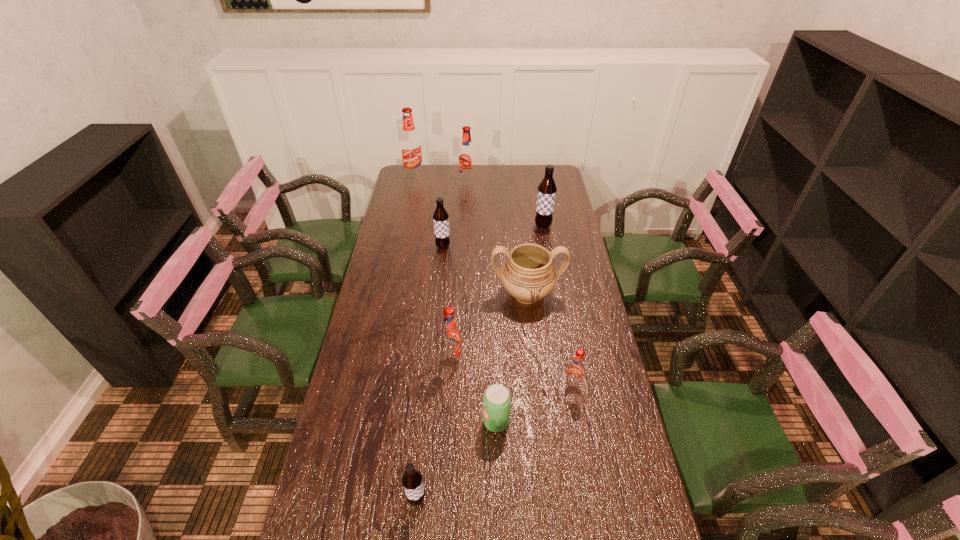
Locate an element on the screen. the second nearest root beer is located at coordinates (576, 370).

Locate an element on the screen. The image size is (960, 540). the nearest red root beer is located at coordinates (576, 370).

The image size is (960, 540). I want to click on the nearest object, so point(412,481).

Where is `the nearest brown root beer`? This screenshot has height=540, width=960. the nearest brown root beer is located at coordinates (412, 481).

This screenshot has height=540, width=960. Find the location of `the second nearest object`. the second nearest object is located at coordinates (496, 401).

Locate an element on the screen. the shortest object is located at coordinates (496, 401).

I want to click on free location located on the right of the leftmost root beer, so coord(494,176).

Identify the location of vacant space located 0.260m on the front of the third smallest red root beer. Image resolution: width=960 pixels, height=540 pixels. (467, 217).

The height and width of the screenshot is (540, 960). In order to click on vacant space positioned 0.400m on the left of the third farthest object in this screenshot , I will do `click(445, 226)`.

Find the location of `vacant space positioned on the front of the second nearest brown root beer`. vacant space positioned on the front of the second nearest brown root beer is located at coordinates (438, 297).